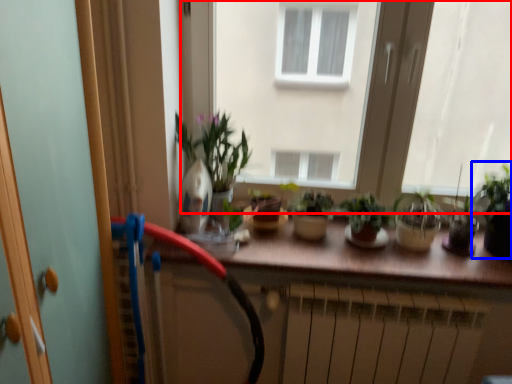
Question: Which object is further to the camera taking this photo, window (highlighted by a red box) or houseplant (highlighted by a blue box)?

Choices:
 (A) window
 (B) houseplant

Answer: (A)